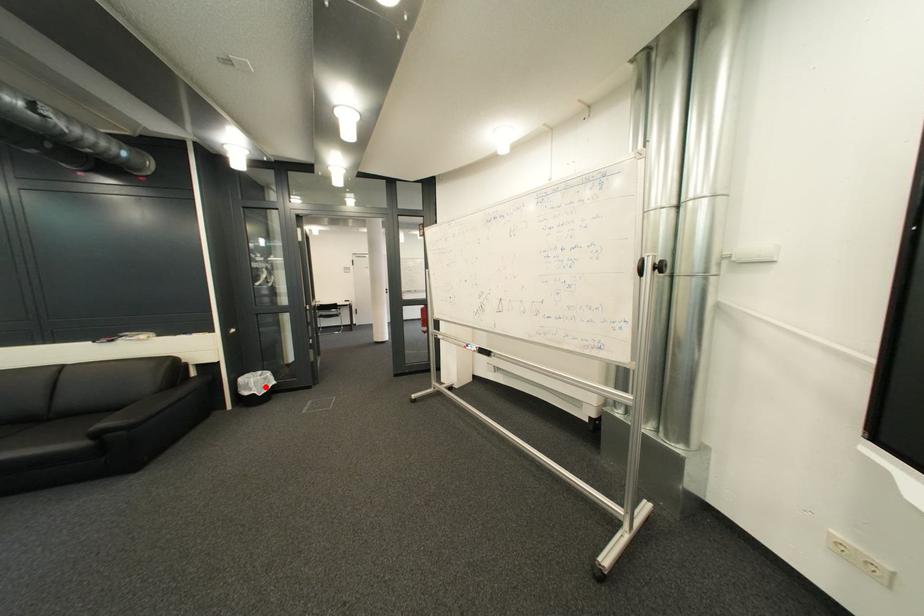
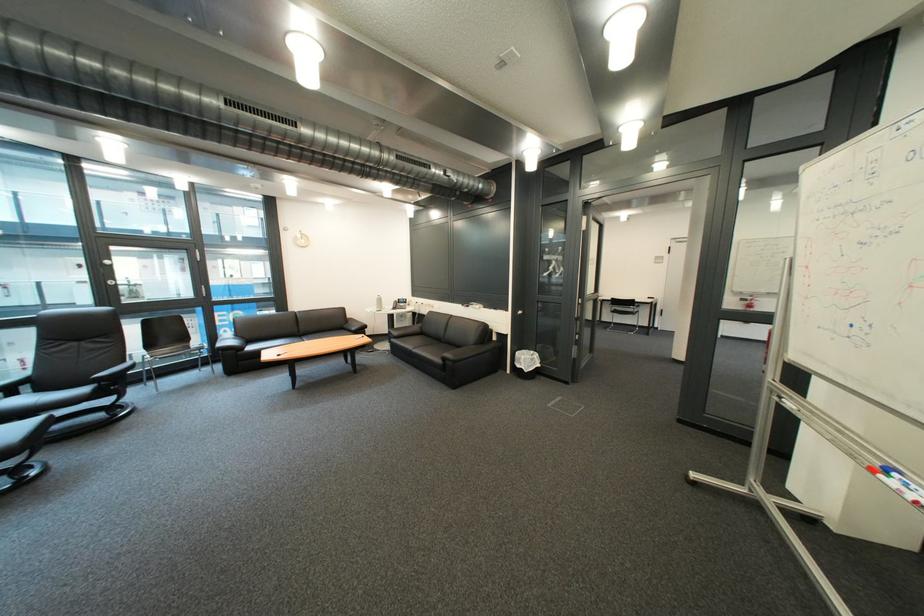
Question: I am providing you with two images of the same scene from different viewpoints. In image1, a red point is highlighted. Considering the same 3D point in image2, which of the following is correct?

Choices:
 (A) It is closer
 (B) It is farther

Answer: (B)